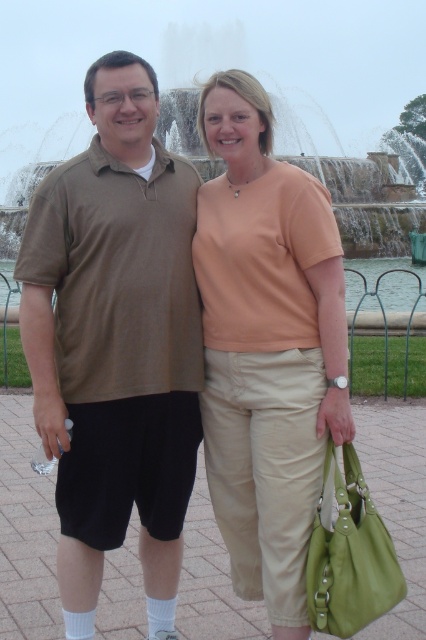
Does brown cotton shirt at left come behind frosted glass water at center?

No, it is in front of frosted glass water at center.

Can you confirm if brown cotton shirt at left is wider than frosted glass water at center?

In fact, brown cotton shirt at left might be narrower than frosted glass water at center.

Find the location of `brown cotton shirt at left`. brown cotton shirt at left is located at coordinates (115, 340).

Between brown cotton shirt at left and beige cotton shirt at center, which one is positioned higher?

beige cotton shirt at center is higher up.

Does brown cotton shirt at left appear under beige cotton shirt at center?

Yes.

The height and width of the screenshot is (640, 426). What are the coordinates of `brown cotton shirt at left` in the screenshot? It's located at (115, 340).

Find the location of a particular element. The image size is (426, 640). beige cotton shirt at center is located at coordinates (267, 346).

Is beige cotton shirt at center to the left of frosted glass water at center from the viewer's perspective?

Indeed, beige cotton shirt at center is positioned on the left side of frosted glass water at center.

This screenshot has width=426, height=640. What do you see at coordinates (267, 346) in the screenshot?
I see `beige cotton shirt at center` at bounding box center [267, 346].

In order to click on beige cotton shirt at center in this screenshot , I will do `click(267, 346)`.